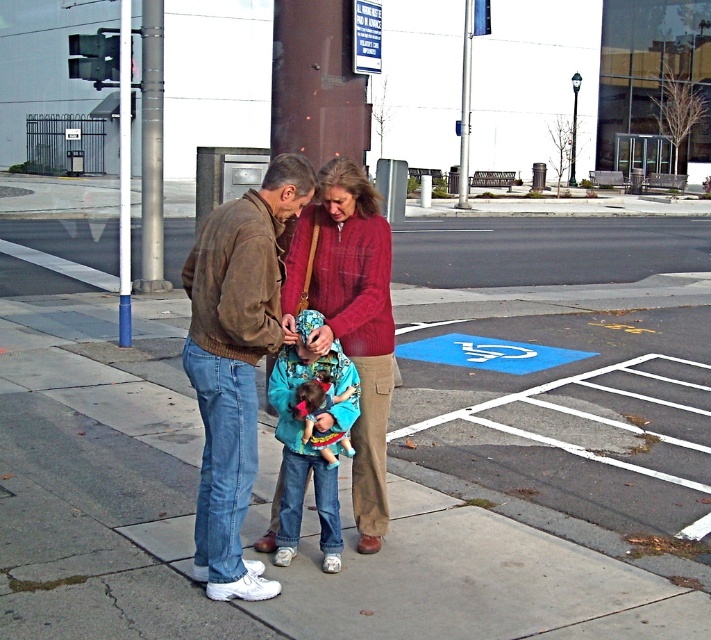
Question: Does silver metallic pole at upper left come behind blue painted metal pole at left?

Choices:
 (A) no
 (B) yes

Answer: (B)

Question: Considering the real-world distances, which object is closest to the denim jacket at center?

Choices:
 (A) concrete sidewalk at center
 (B) blue plastic sign at upper center

Answer: (A)

Question: Does brown suede jacket at center have a larger size compared to blue painted metal pole at left?

Choices:
 (A) yes
 (B) no

Answer: (B)

Question: Is blue painted metal pole at left in front of blue denim jeans at center?

Choices:
 (A) yes
 (B) no

Answer: (B)

Question: Estimate the real-world distances between objects in this image. Which object is farther from the concrete sidewalk at center?

Choices:
 (A) brushed metal pole at center
 (B) silver metallic pole at upper left

Answer: (A)

Question: Considering the real-world distances, which object is closest to the blue plastic sign at upper center?

Choices:
 (A) silver metallic pole at upper left
 (B) denim jacket at center
 (C) blue denim jeans at center
 (D) matte red sweater at center

Answer: (D)